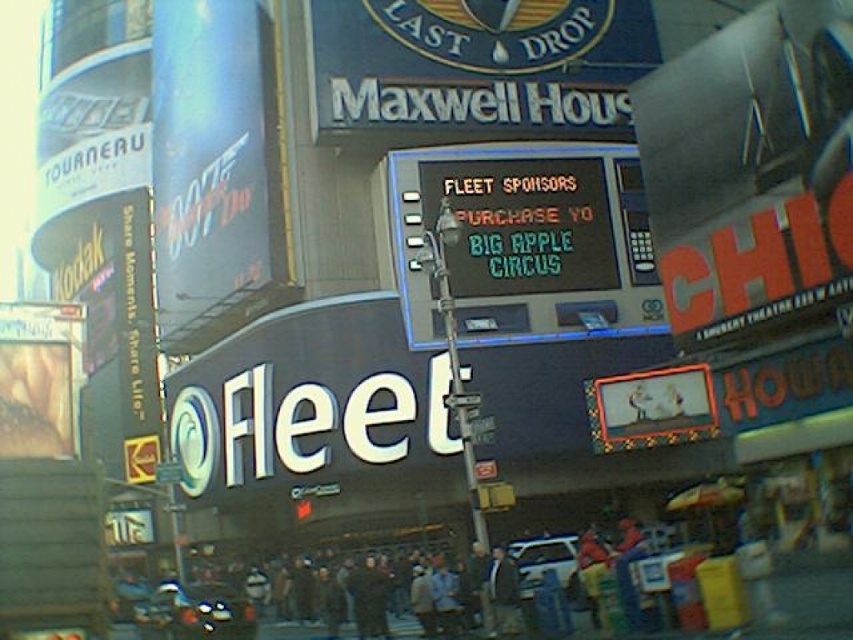
Does black digital sign at center have a lesser width compared to shiny black motorcycle at lower left?

Incorrect, black digital sign at center's width is not less than shiny black motorcycle at lower left's.

Which is behind, point (575, 243) or point (218, 611)?

The point (575, 243) is more distant.

Find the location of a particular element. The width and height of the screenshot is (853, 640). black digital sign at center is located at coordinates (523, 224).

Who is lower down, shiny black motorcycle at lower left or white matte car at center?

shiny black motorcycle at lower left is below.

Can you confirm if shiny black motorcycle at lower left is taller than white matte car at center?

Yes, shiny black motorcycle at lower left is taller than white matte car at center.

Which is behind, point (161, 588) or point (566, 568)?

The point (161, 588) is more distant.

Locate an element on the screen. The width and height of the screenshot is (853, 640). shiny black motorcycle at lower left is located at coordinates (194, 612).

Image resolution: width=853 pixels, height=640 pixels. Identify the location of white matte car at center. (544, 561).

Is white matte car at center positioned at the back of dark gray jacket at center?

That is True.

Describe the element at coordinates (544, 561) in the screenshot. The width and height of the screenshot is (853, 640). I see `white matte car at center` at that location.

Identify the location of white matte car at center. (544, 561).